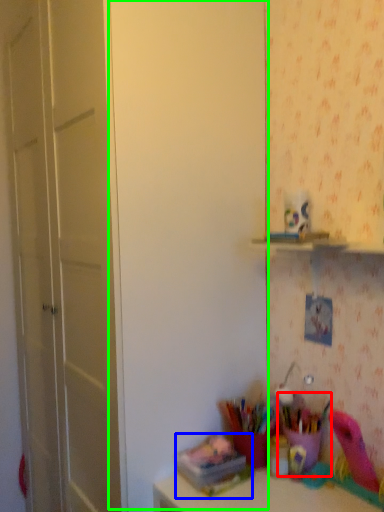
Question: Based on their relative distances, which object is farther from stationery (highlighted by a red box)? Choose from stationery (highlighted by a blue box) and door (highlighted by a green box).

Choices:
 (A) stationery
 (B) door

Answer: (B)